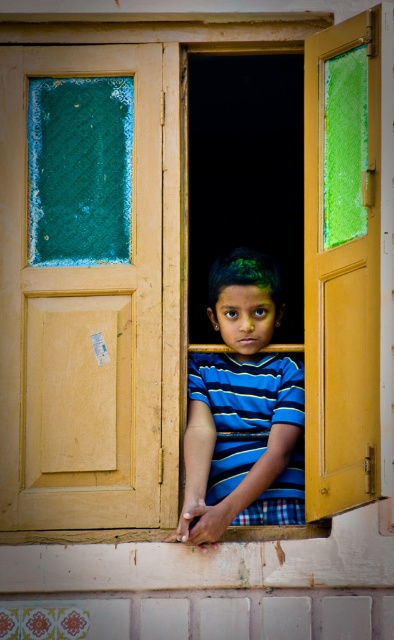
Question: Which of the following is the farthest from the observer?

Choices:
 (A) wooden textured window sill at lower center
 (B) yellow matte door at right

Answer: (A)

Question: Where is blue striped shirt at center located in relation to wooden textured window sill at lower center in the image?

Choices:
 (A) below
 (B) above

Answer: (B)

Question: From the image, what is the correct spatial relationship of yellow matte door at right in relation to blue striped shirt at center?

Choices:
 (A) right
 (B) left

Answer: (A)

Question: Based on their relative distances, which object is nearer to the wooden door at center?

Choices:
 (A) yellow matte door at right
 (B) wooden textured window sill at lower center

Answer: (A)

Question: Can you confirm if wooden door at center is positioned below blue striped shirt at center?

Choices:
 (A) no
 (B) yes

Answer: (A)

Question: Which object is positioned closest to the wooden textured window sill at lower center?

Choices:
 (A) wooden door at center
 (B) blue striped shirt at center

Answer: (B)